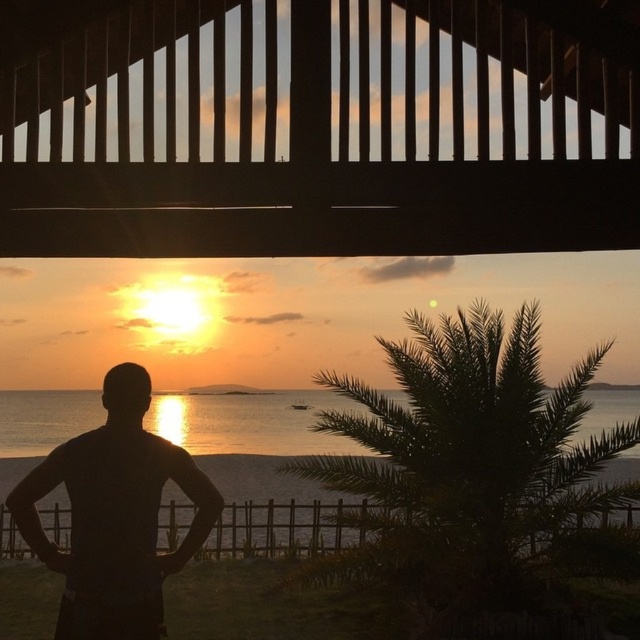
Does silvery water at center appear on the left side of black matte man at center?

In fact, silvery water at center is to the right of black matte man at center.

Does silvery water at center appear on the right side of black matte man at center?

Correct, you'll find silvery water at center to the right of black matte man at center.

Who is more distant from viewer, (58, 406) or (140, 458)?

Point (58, 406)

Locate an element on the screen. The height and width of the screenshot is (640, 640). silvery water at center is located at coordinates (257, 460).

Who is positioned more to the left, black matte man at center or brown wooden rail at lower center?

black matte man at center is more to the left.

Between point (118, 364) and point (531, 540), which one is positioned behind?

Point (531, 540)

At what (x,y) coordinates should I click in order to perform the action: click on black matte man at center. Please return your answer as a coordinate pair (x, y). Image resolution: width=640 pixels, height=640 pixels. Looking at the image, I should click on (115, 515).

Between point (630, 417) and point (317, 515), which one is positioned in front?

Point (630, 417)

Consider the image. Does silvery water at center have a greater width compared to brown wooden rail at lower center?

Yes, silvery water at center is wider than brown wooden rail at lower center.

Which is in front, point (292, 512) or point (67, 547)?

Positioned in front is point (67, 547).

What are the coordinates of `silvery water at center` in the screenshot? It's located at (257, 460).